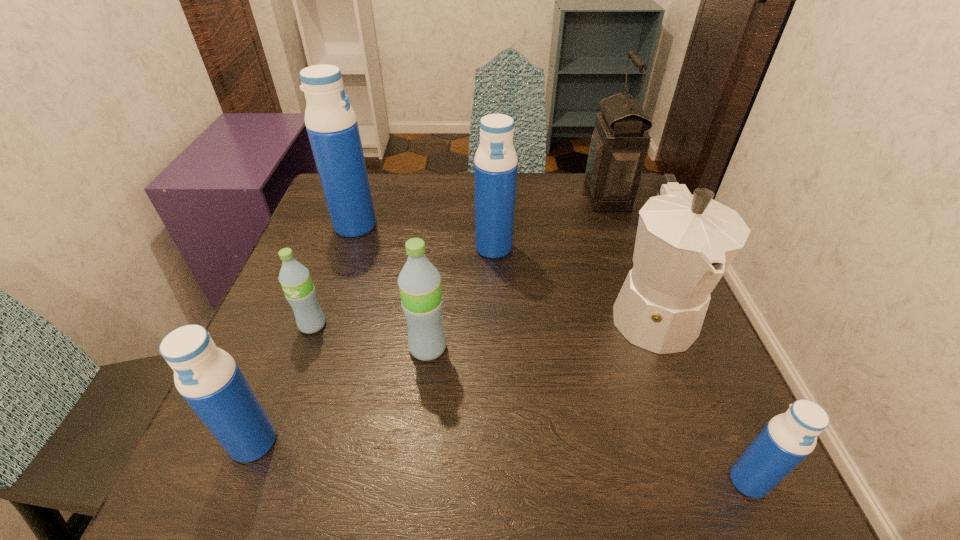
This screenshot has width=960, height=540. In order to click on blue water bottle that is the third closest one to the third biggest blue water bottle in this screenshot , I will do `click(788, 438)`.

Select which blue water bottle is the closest to the tallest water bottle. Please provide its 2D coordinates. Your answer should be formatted as a tuple, i.e. [(x, y)], where the tuple contains the x and y coordinates of a point satisfying the conditions above.

[(495, 169)]

Find the location of a particular element. This screenshot has width=960, height=540. free region that satisfies the following two spatial constraints: 1. at the spout of the rightmost water bottle; 2. on the left side of the coffeepot is located at coordinates (715, 481).

Locate an element on the screen. free space in the image that satisfies the following two spatial constraints: 1. at the spout of the rightmost blue water bottle; 2. on the left side of the coffeepot is located at coordinates (715, 481).